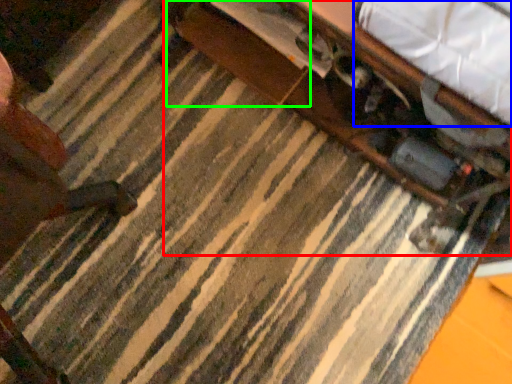
Question: Based on their relative distances, which object is nearer to table (highlighted by a red box)? Choose from sheet (highlighted by a blue box) and drawer (highlighted by a green box).

Choices:
 (A) sheet
 (B) drawer

Answer: (B)